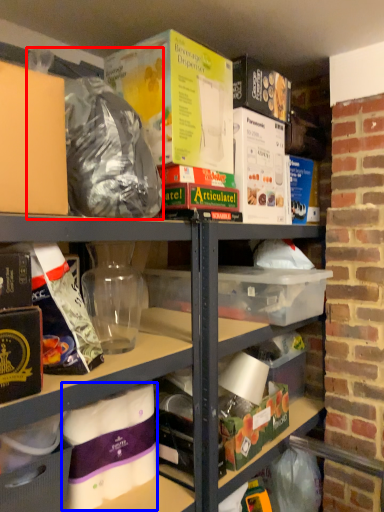
Question: Which of the following is the farthest to the observer, garbage (highlighted by a red box) or yoghurt (highlighted by a blue box)?

Choices:
 (A) garbage
 (B) yoghurt

Answer: (B)